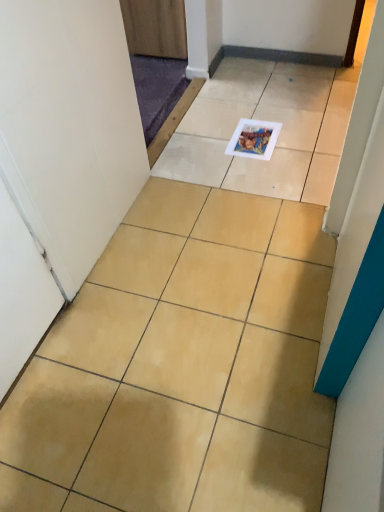
Question: Does wooden door at upper center have a smaller size compared to matte plastic magazine at center?

Choices:
 (A) yes
 (B) no

Answer: (B)

Question: Would you say wooden door at upper center is a long distance from matte plastic magazine at center?

Choices:
 (A) yes
 (B) no

Answer: (B)

Question: From the image's perspective, would you say wooden door at upper center is positioned over matte plastic magazine at center?

Choices:
 (A) no
 (B) yes

Answer: (B)

Question: Could you tell me if wooden door at upper center is facing matte plastic magazine at center?

Choices:
 (A) no
 (B) yes

Answer: (A)

Question: From the image's perspective, would you say wooden door at upper center is shown under matte plastic magazine at center?

Choices:
 (A) no
 (B) yes

Answer: (A)

Question: Can matte plastic magazine at center be found inside wooden door at upper center?

Choices:
 (A) no
 (B) yes

Answer: (A)

Question: Does matte plastic magazine at center contain beige ceramic tile at center?

Choices:
 (A) yes
 (B) no

Answer: (B)

Question: From the image's perspective, is matte plastic magazine at center below beige ceramic tile at center?

Choices:
 (A) no
 (B) yes

Answer: (A)

Question: Is matte plastic magazine at center oriented towards beige ceramic tile at center?

Choices:
 (A) no
 (B) yes

Answer: (B)

Question: Is matte plastic magazine at center looking in the opposite direction of beige ceramic tile at center?

Choices:
 (A) yes
 (B) no

Answer: (A)

Question: Is matte plastic magazine at center smaller than beige ceramic tile at center?

Choices:
 (A) yes
 (B) no

Answer: (A)

Question: From a real-world perspective, is matte plastic magazine at center positioned under beige ceramic tile at center based on gravity?

Choices:
 (A) yes
 (B) no

Answer: (B)

Question: Can you confirm if wooden door at upper center is wider than beige ceramic tile at center?

Choices:
 (A) yes
 (B) no

Answer: (B)